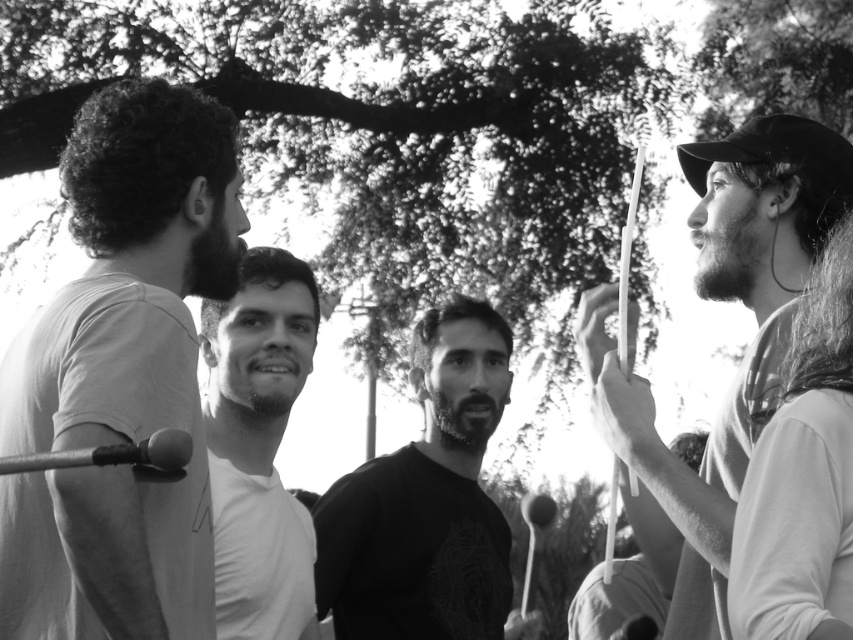
You are a photographer who wants to focus on the white matte t shirt at left. Where should you point your camera to capture the point at coordinates (x=120, y=374)?

The point at coordinates (x=120, y=374) is located on the white matte t shirt at left. Therefore, to capture this point, you should aim your camera directly at the white matte t shirt at left.